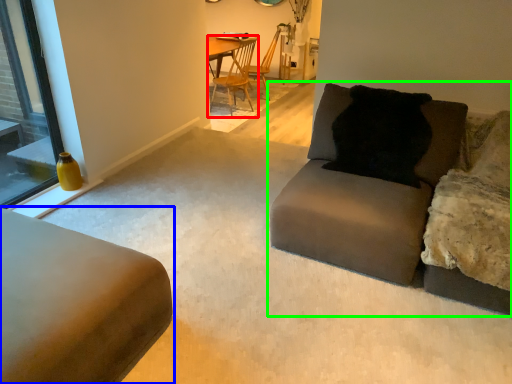
Question: Which object is the farthest from chair (highlighted by a red box)? Choose among these: studio couch (highlighted by a blue box) or studio couch (highlighted by a green box).

Choices:
 (A) studio couch
 (B) studio couch

Answer: (A)